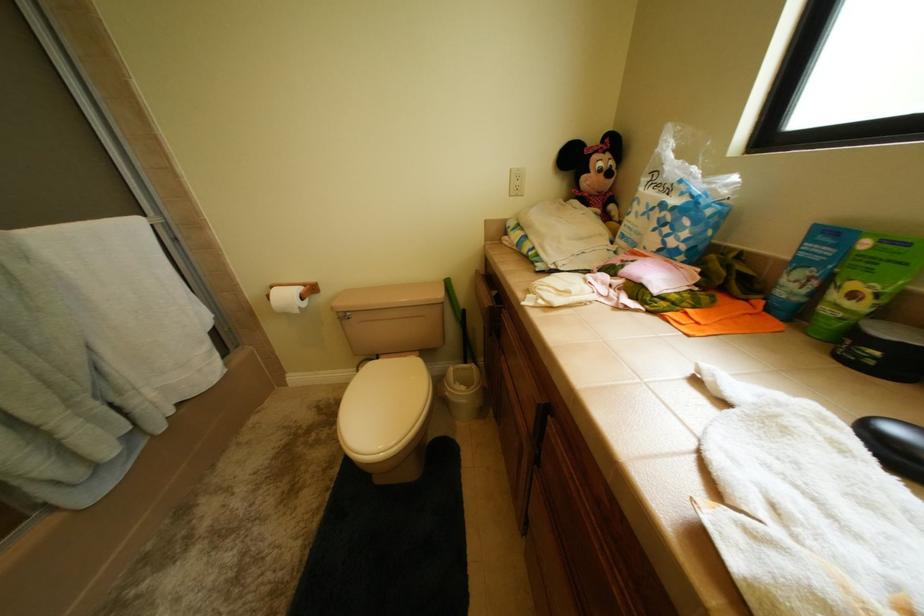
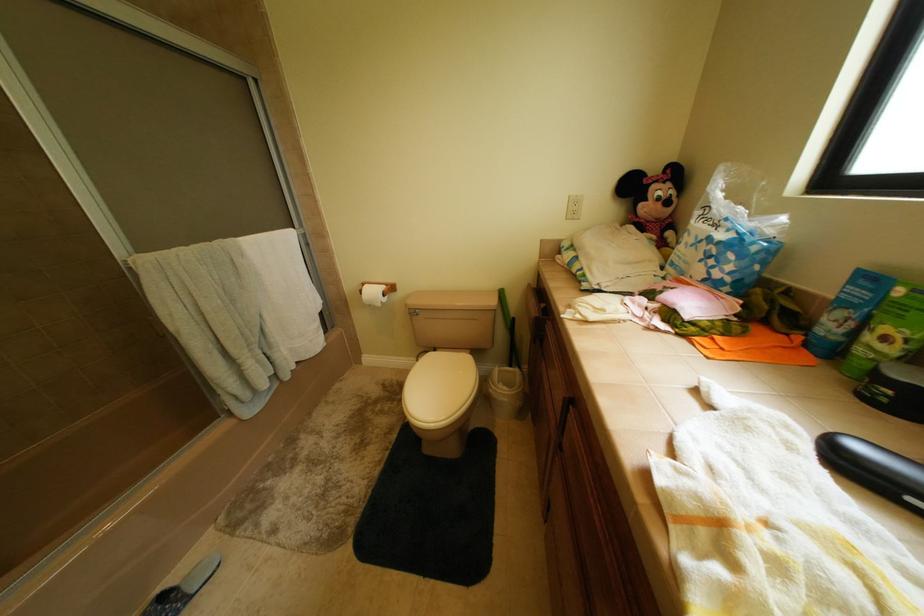
Question: The camera is either moving clockwise (left) or counter-clockwise (right) around the object. The first image is from the beginning of the video and the second image is from the end. Is the camera moving left or right when shooting the video?

Choices:
 (A) Left
 (B) Right

Answer: (B)